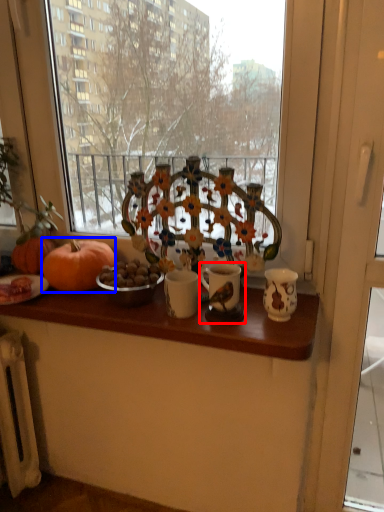
Question: Which point is further to the camera, candle holder (highlighted by a red box) or pumpkin (highlighted by a blue box)?

Choices:
 (A) candle holder
 (B) pumpkin

Answer: (B)